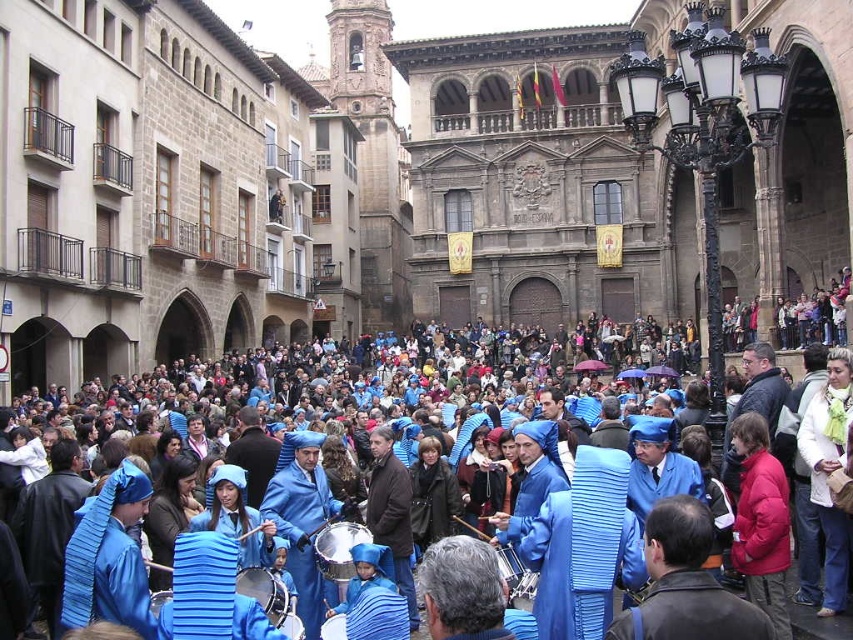
You are a performer in the parade and need to retrieve your metallic drum at center from under the blue striped fabric at center. Is the drum accessible without moving the fabric?

The blue striped fabric at center is positioned over the metallic drum at center, so you will need to move the fabric to access the drum.

You are a performer in the parade and need to retrieve your drum. You see both the shiny silver drum at center and the metallic drum at center. Which drum is closer to you?

The shiny silver drum at center is closer to you since it is further to the viewer than the metallic drum at center.

You are standing in the town square and want to reach the point marked by the coordinates. Which point is closer to you, point (x=74, y=412) or point (x=515, y=556)?

Point (x=515, y=556) is closer to you because it is in front of point (x=74, y=412).